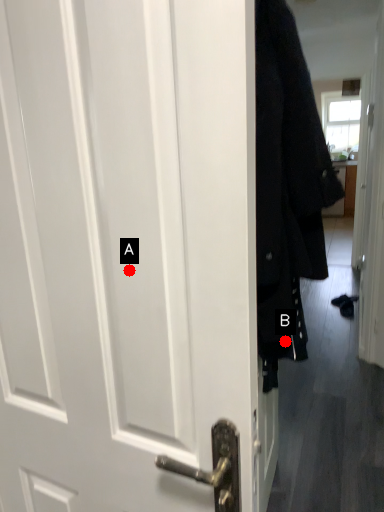
Question: Two points are circled on the image, labeled by A and B beside each circle. Which of the following is the farthest from the observer?

Choices:
 (A) A is further
 (B) B is further

Answer: (B)